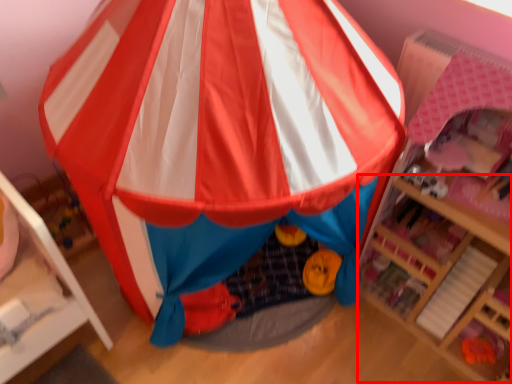
Question: From the image's perspective, what is the correct spatial positioning of shelf (annotated by the red box) in reference to tent?

Choices:
 (A) above
 (B) below

Answer: (B)